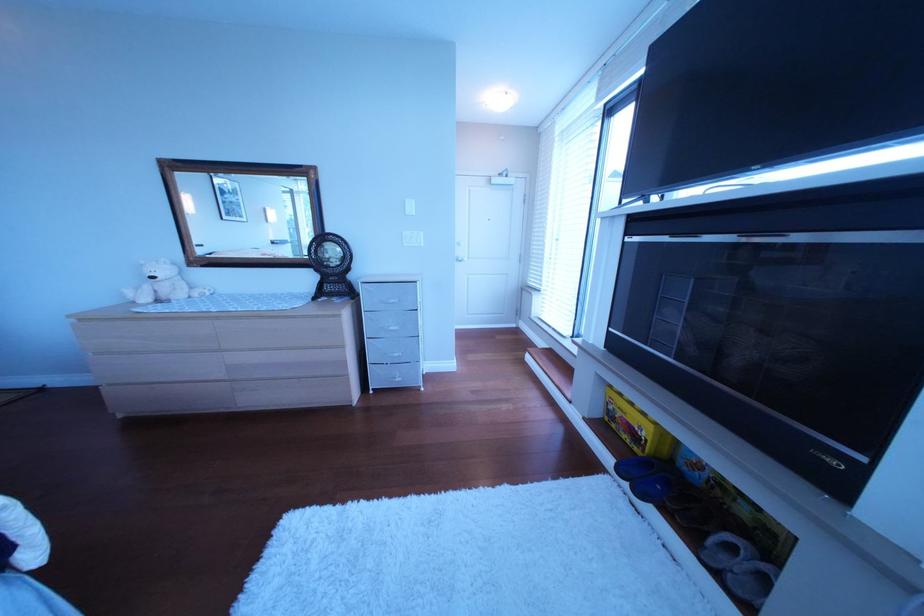
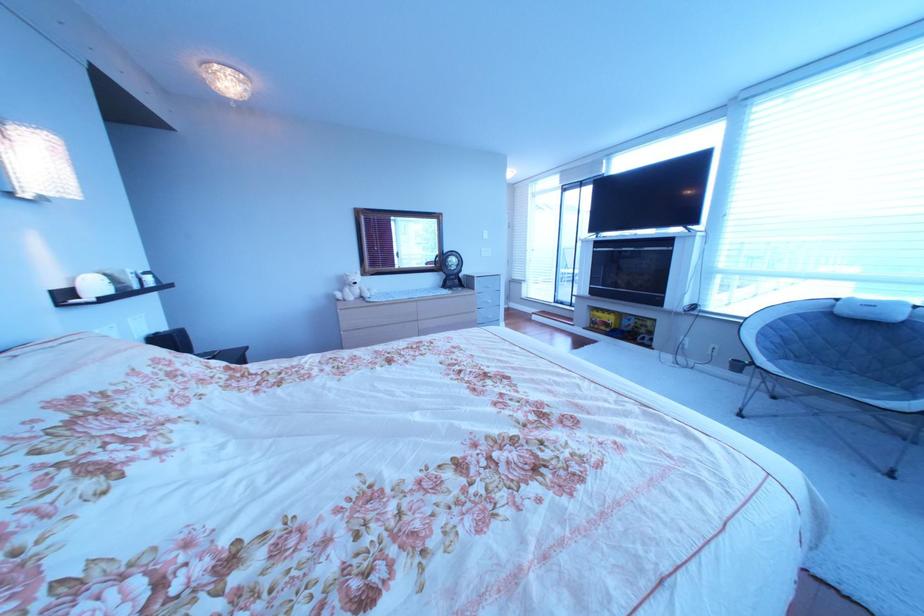
In a continuous first-person perspective shot, in which direction is the camera moving?

The cameraman walked toward left, backward.